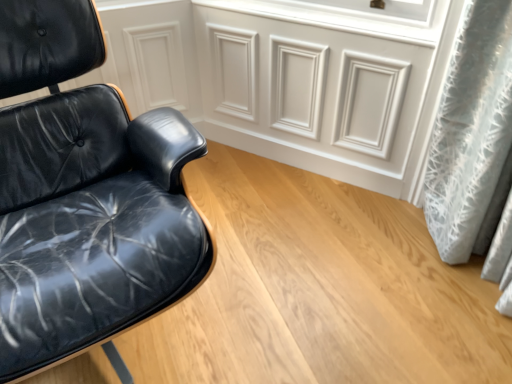
What is the approximate height of black leather chair at left?

32.97 inches.

You are a GUI agent. You are given a task and a screenshot of the screen. Output one action in this format:
    pyautogui.click(x=<x>, y=<y>)
    Task: Click on the black leather chair at left
    The height and width of the screenshot is (384, 512).
    Given the screenshot: What is the action you would take?
    pyautogui.click(x=84, y=195)

What is the approximate width of black leather chair at left?

black leather chair at left is 35.65 inches in width.

This screenshot has height=384, width=512. Describe the element at coordinates (84, 195) in the screenshot. I see `black leather chair at left` at that location.

Describe the element at coordinates (318, 77) in the screenshot. This screenshot has width=512, height=384. I see `white matte panel at upper center` at that location.

The width and height of the screenshot is (512, 384). What are the coordinates of `white matte panel at upper center` in the screenshot? It's located at (318, 77).

Image resolution: width=512 pixels, height=384 pixels. In order to click on black leather chair at left in this screenshot , I will do `click(84, 195)`.

Considering the positions of objects white matte panel at upper center and black leather chair at left in the image provided, who is more to the right, white matte panel at upper center or black leather chair at left?

white matte panel at upper center is more to the right.

Looking at this image, is white matte panel at upper center closer to camera compared to black leather chair at left?

No, it is behind black leather chair at left.

Is point (386, 31) closer or farther from the camera than point (25, 135)?

Point (386, 31).

From the image's perspective, would you say white matte panel at upper center is positioned over black leather chair at left?

Yes, from the image's perspective, white matte panel at upper center is above black leather chair at left.

From a real-world perspective, who is located higher, white matte panel at upper center or black leather chair at left?

From a 3D spatial view, black leather chair at left is above.

Which of these two, white matte panel at upper center or black leather chair at left, is wider?

black leather chair at left is wider.

Is white matte panel at upper center shorter than black leather chair at left?

Correct, white matte panel at upper center is not as tall as black leather chair at left.

Does white matte panel at upper center have a smaller size compared to black leather chair at left?

Yes.

In the scene shown: Is white matte panel at upper center completely or partially outside of black leather chair at left?

That's correct, white matte panel at upper center is outside of black leather chair at left.

Is white matte panel at upper center directly adjacent to black leather chair at left?

No, white matte panel at upper center is not making contact with black leather chair at left.

Does white matte panel at upper center turn towards black leather chair at left?

Yes, white matte panel at upper center is oriented towards black leather chair at left.

Find the location of a particular element. The height and width of the screenshot is (384, 512). drawer above the black leather chair at left (from the image's perspective) is located at coordinates (318, 77).

Considering the relative positions of black leather chair at left and white matte panel at upper center in the image provided, is black leather chair at left to the left or to the right of white matte panel at upper center?

black leather chair at left is to the left of white matte panel at upper center.

Between black leather chair at left and white matte panel at upper center, which one is positioned in front?

black leather chair at left.

Which is nearer, (8, 197) or (259, 116)?

Point (8, 197)

From the image's perspective, is black leather chair at left beneath white matte panel at upper center?

Yes.

From a real-world perspective, is black leather chair at left on top of white matte panel at upper center?

Yes, from a real-world perspective, black leather chair at left is on top of white matte panel at upper center.

Considering the relative sizes of black leather chair at left and white matte panel at upper center in the image provided, is black leather chair at left wider than white matte panel at upper center?

Indeed, black leather chair at left has a greater width compared to white matte panel at upper center.

Who is taller, black leather chair at left or white matte panel at upper center?

black leather chair at left is taller.

Is black leather chair at left bigger than white matte panel at upper center?

Correct, black leather chair at left is larger in size than white matte panel at upper center.

Is black leather chair at left spatially inside white matte panel at upper center, or outside of it?

The correct answer is: outside.

Is there a large distance between black leather chair at left and white matte panel at upper center?

black leather chair at left is near white matte panel at upper center, not far away.

Is black leather chair at left turned away from white matte panel at upper center?

No, black leather chair at left's orientation is not away from white matte panel at upper center.

Locate an element on the screen. This screenshot has height=384, width=512. chair in front of the white matte panel at upper center is located at coordinates (84, 195).

At what (x,y) coordinates should I click in order to perform the action: click on drawer lying above the black leather chair at left (from the image's perspective). Please return your answer as a coordinate pair (x, y). This screenshot has height=384, width=512. Looking at the image, I should click on (318, 77).

The image size is (512, 384). Find the location of `chair in front of the white matte panel at upper center`. chair in front of the white matte panel at upper center is located at coordinates (84, 195).